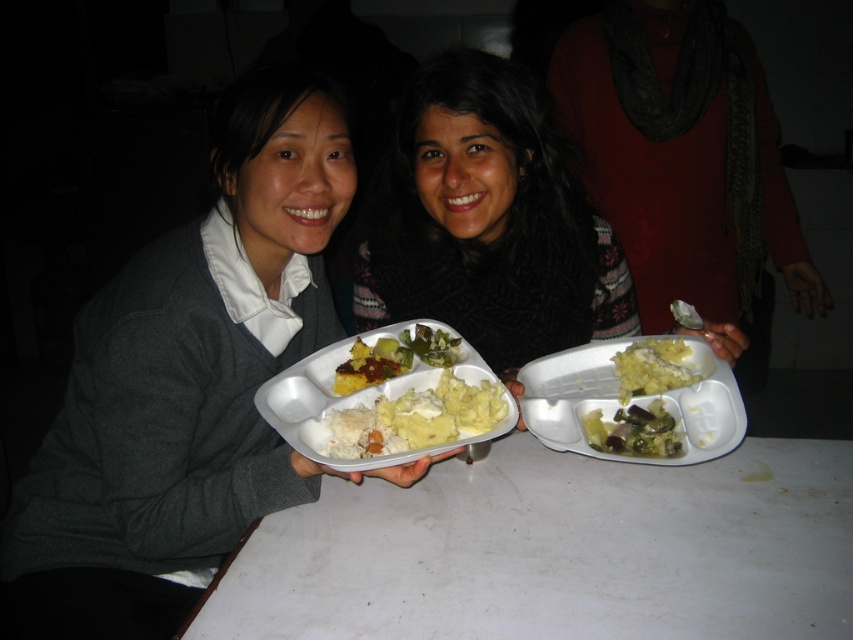
Question: Observing the image, what is the correct spatial positioning of white creamy mashed potatoes at center in reference to yellowish matte mashed potatoes at center?

Choices:
 (A) above
 (B) below

Answer: (B)

Question: Based on their relative distances, which object is farther from the yellowish matte mashed potatoes at center?

Choices:
 (A) white matte table at center
 (B) yellowish matte food at center
 (C) green matte mashed potatoes at center

Answer: (A)

Question: Which point is closer to the camera taking this photo?

Choices:
 (A) (604, 404)
 (B) (408, 326)

Answer: (A)

Question: Which of the following is the closest to the observer?

Choices:
 (A) white creamy mashed potatoes at center
 (B) matte gray sweater at left
 (C) yellowish matte mashed potatoes at center

Answer: (B)

Question: Does white matte tray at center have a smaller size compared to green leafy vegetables at center?

Choices:
 (A) no
 (B) yes

Answer: (A)

Question: Can you confirm if dark brown sweater at center is positioned above white creamy mashed potatoes at center?

Choices:
 (A) yes
 (B) no

Answer: (A)